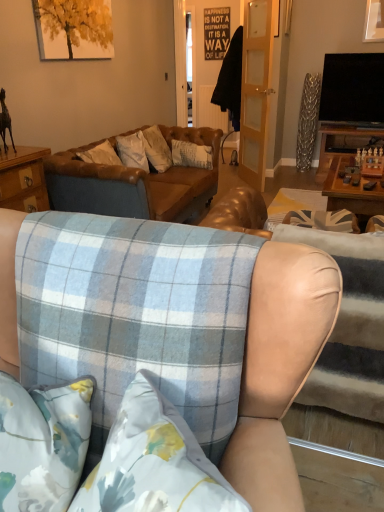
Question: Is blue plaid fabric at center, arranged as the 2th studio couch when viewed from the front, closer to the viewer compared to blue plaid fabric at center, placed as the 1th studio couch when sorted from front to back?

Choices:
 (A) yes
 (B) no

Answer: (B)

Question: Can you confirm if blue plaid fabric at center, arranged as the 2th studio couch when viewed from the front, is thinner than blue plaid fabric at center, positioned as the third studio couch in back-to-front order?

Choices:
 (A) yes
 (B) no

Answer: (B)

Question: From the image's perspective, is blue plaid fabric at center, placed as the second studio couch when sorted from back to front, located beneath blue plaid fabric at center, positioned as the third studio couch in back-to-front order?

Choices:
 (A) no
 (B) yes

Answer: (A)

Question: From a real-world perspective, is blue plaid fabric at center, placed as the second studio couch when sorted from back to front, located higher than blue plaid fabric at center, positioned as the third studio couch in back-to-front order?

Choices:
 (A) no
 (B) yes

Answer: (A)

Question: Considering the relative positions of blue plaid fabric at center, arranged as the 2th studio couch when viewed from the front, and blue plaid fabric at center, placed as the 1th studio couch when sorted from front to back, in the image provided, is blue plaid fabric at center, arranged as the 2th studio couch when viewed from the front, to the right of blue plaid fabric at center, placed as the 1th studio couch when sorted from front to back, from the viewer's perspective?

Choices:
 (A) no
 (B) yes

Answer: (B)

Question: From a real-world perspective, is blue plaid fabric at center, placed as the 1th studio couch when sorted from front to back, positioned above or below blue plaid fabric couch at center, positioned as the 1th studio couch in back-to-front order?

Choices:
 (A) above
 (B) below

Answer: (A)

Question: In terms of size, does blue plaid fabric at center, positioned as the third studio couch in back-to-front order, appear bigger or smaller than blue plaid fabric couch at center, which appears as the third studio couch when viewed from the front?

Choices:
 (A) big
 (B) small

Answer: (B)

Question: Is blue plaid fabric at center, positioned as the third studio couch in back-to-front order, taller or shorter than blue plaid fabric couch at center, which appears as the third studio couch when viewed from the front?

Choices:
 (A) tall
 (B) short

Answer: (A)

Question: In the image, is blue plaid fabric at center, placed as the 1th studio couch when sorted from front to back, positioned in front of or behind blue plaid fabric couch at center, which appears as the third studio couch when viewed from the front?

Choices:
 (A) behind
 (B) front

Answer: (B)

Question: Considering the positions of blue plaid fabric at center, positioned as the third studio couch in back-to-front order, and blue plaid fabric at center, placed as the second studio couch when sorted from back to front, in the image, is blue plaid fabric at center, positioned as the third studio couch in back-to-front order, wider or thinner than blue plaid fabric at center, placed as the second studio couch when sorted from back to front,?

Choices:
 (A) thin
 (B) wide

Answer: (A)

Question: Is blue plaid fabric at center, placed as the 1th studio couch when sorted from front to back, spatially inside blue plaid fabric at center, placed as the second studio couch when sorted from back to front, or outside of it?

Choices:
 (A) inside
 (B) outside

Answer: (B)

Question: In terms of size, does blue plaid fabric at center, placed as the 1th studio couch when sorted from front to back, appear bigger or smaller than blue plaid fabric at center, placed as the second studio couch when sorted from back to front?

Choices:
 (A) big
 (B) small

Answer: (A)

Question: Based on their positions, is blue plaid fabric at center, placed as the 1th studio couch when sorted from front to back, located to the left or right of blue plaid fabric at center, placed as the second studio couch when sorted from back to front?

Choices:
 (A) left
 (B) right

Answer: (A)

Question: Considering the positions of point (79, 161) and point (3, 228), is point (79, 161) closer or farther from the camera than point (3, 228)?

Choices:
 (A) farther
 (B) closer

Answer: (A)

Question: From the image's perspective, relative to blue plaid fabric at center, positioned as the third studio couch in back-to-front order, is blue plaid fabric couch at center, positioned as the 1th studio couch in back-to-front order, above or below?

Choices:
 (A) below
 (B) above

Answer: (B)